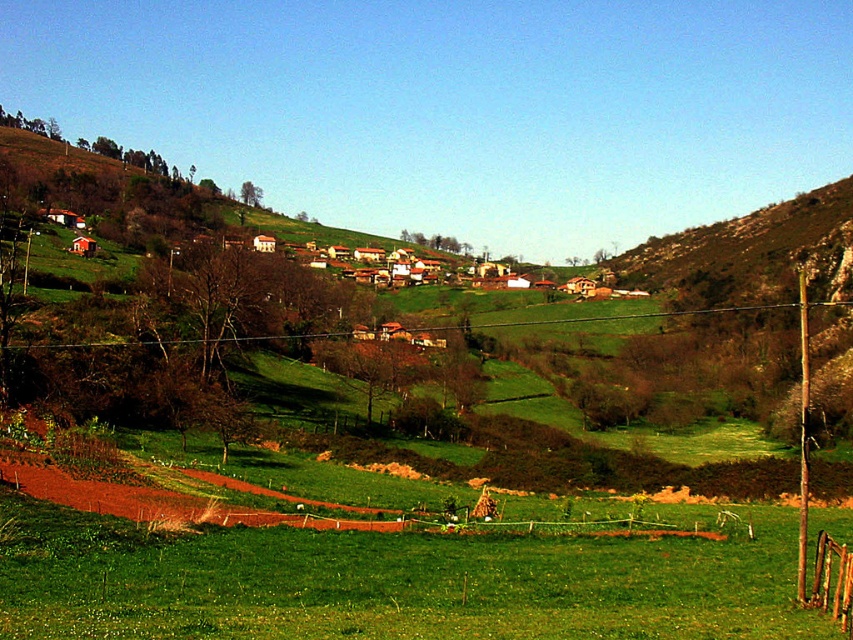
You are a photographer standing in the field and want to capture both the brown wooden fence at lower right and the brown furry dog at center in a single frame. Which object should you position closer to the edge of the frame to include both?

Since the brown wooden fence at lower right is wider than the brown furry dog at center, you should position the brown wooden fence at lower right closer to the edge of the frame to ensure both fit within the shot.

You are standing in the field and see the brown wooden fence at lower right and the brown furry dog at center. Which object is located to the right side of the other?

The brown wooden fence at lower right is to the right of the brown furry dog at center.

You are a photographer standing in the field and want to capture both the brown wooden fence at lower right and the brown furry dog at center in a single frame. Which object should you move closer to in order to include both in your photo?

To include both the brown wooden fence at lower right and the brown furry dog at center in the photo, you should move closer to the brown wooden fence at lower right since it is smaller in size and needs to be enlarged in the frame to balance with the larger brown furry dog at center.